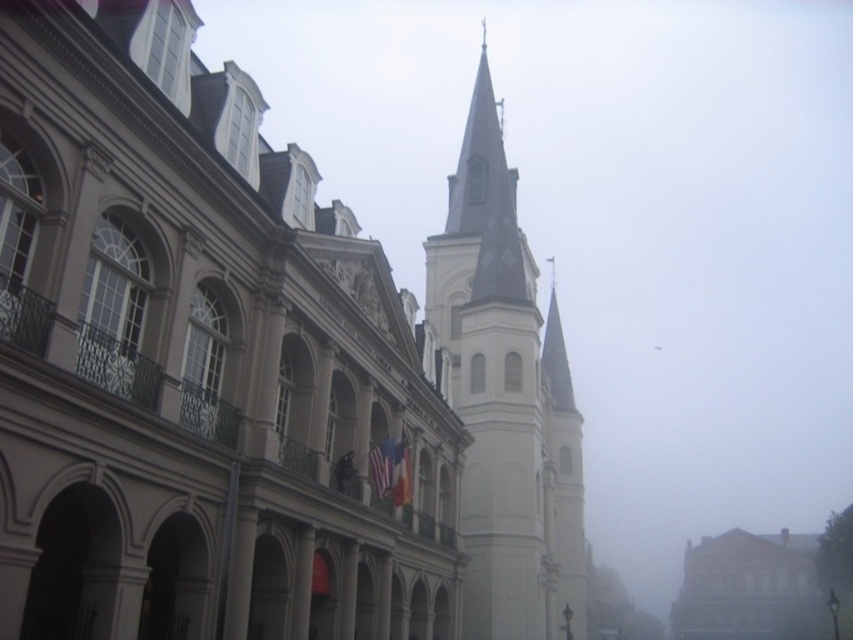
You are a tourist in New Orleans and see the white stone church at center and the white stone steeple at center in the image. Which one is positioned to the left?

The white stone church at center is positioned to the left of the white stone steeple at center.

You are a tour guide leading a group in New Orleans. You point to the white stone steeple at center and mention that it is part of a historic church. A tourist asks if the steeple is closer to the historic building or the church. How would you respond?

The white stone steeple at center is part of the church, so it is closer to the church than the historic building.

You are a photographer planning to capture the historic French colonial building and the church steeple in the same frame. Given the white stone church at center and the smooth white building at lower right, which structure would you need to focus on more carefully to ensure it appears proportionally smaller in your composition?

The white stone church at center is thinner than the smooth white building at lower right, so you should focus more on ensuring the white stone church at center appears proportionally smaller in the composition.